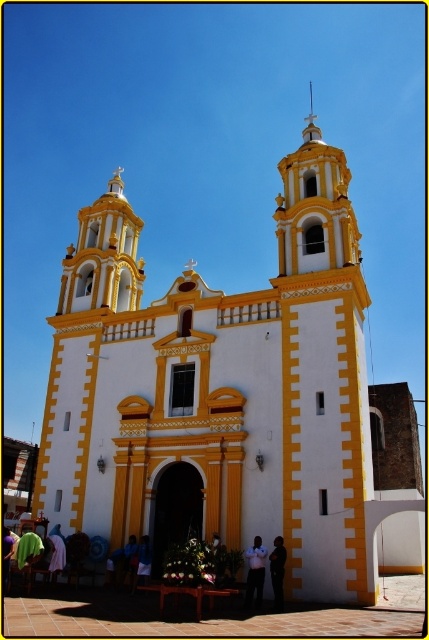
Question: Observing the image, what is the correct spatial positioning of light brown leather jacket at lower center in reference to dark fabric shirt at center?

Choices:
 (A) right
 (B) left

Answer: (B)

Question: Which object appears closest to the camera in this image?

Choices:
 (A) light brown leather jacket at lower center
 (B) dark fabric shirt at center

Answer: (B)

Question: Which of the following is the closest to the observer?

Choices:
 (A) dark blue fabric at lower center
 (B) light brown leather jacket at lower center

Answer: (B)

Question: Considering the relative positions of light brown leather jacket at lower center and dark fabric shirt at center in the image provided, where is light brown leather jacket at lower center located with respect to dark fabric shirt at center?

Choices:
 (A) below
 (B) above

Answer: (A)

Question: Observing the image, what is the correct spatial positioning of white painted stone church at center in reference to dark blue fabric at lower center?

Choices:
 (A) right
 (B) left

Answer: (A)

Question: Among these objects, which one is farthest from the camera?

Choices:
 (A) white painted stone church at center
 (B) light brown leather jacket at lower center
 (C) dark fabric shirt at center

Answer: (B)